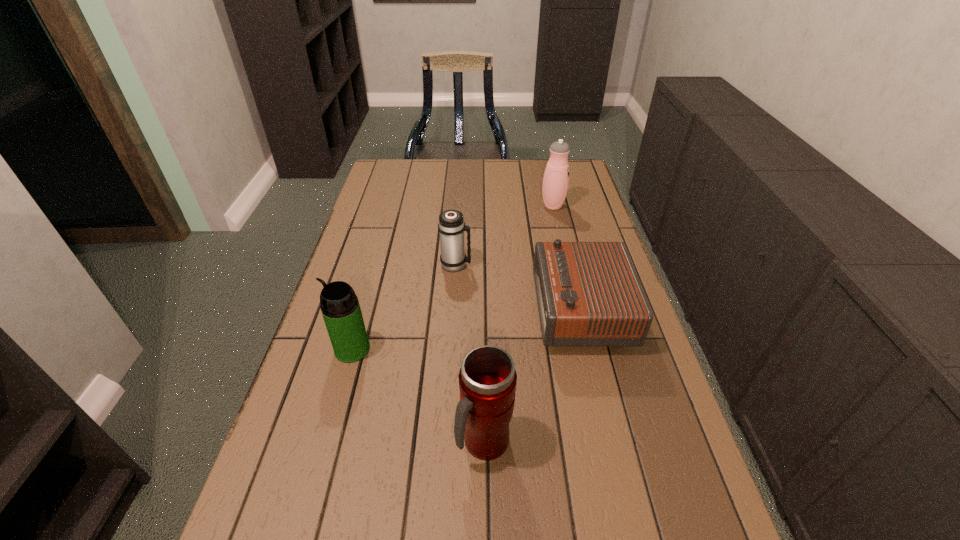
Locate an element on the screen. The height and width of the screenshot is (540, 960). vacant space at the right edge of the desktop is located at coordinates (568, 197).

Where is `free spot between the nearest object and the leftmost object`? Image resolution: width=960 pixels, height=540 pixels. free spot between the nearest object and the leftmost object is located at coordinates (419, 396).

Locate an element on the screen. free space between the second nearest thermos bottle and the shortest thermos bottle is located at coordinates (404, 307).

Where is `free space between the radio receiver and the nearest thermos bottle`? Image resolution: width=960 pixels, height=540 pixels. free space between the radio receiver and the nearest thermos bottle is located at coordinates (533, 376).

Locate an element on the screen. This screenshot has width=960, height=540. unoccupied area between the nearest object and the third farthest thermos bottle is located at coordinates (419, 396).

Identify the location of vacant space that's between the second farthest object and the farthest thermos bottle. 504,235.

I want to click on vacant space that's between the radio receiver and the third nearest thermos bottle, so (x=518, y=288).

Where is `free space between the radio receiver and the nearest thermos bottle`? This screenshot has width=960, height=540. free space between the radio receiver and the nearest thermos bottle is located at coordinates (533, 376).

Image resolution: width=960 pixels, height=540 pixels. Identify the location of free area in between the leftmost thermos bottle and the shortest thermos bottle. (404, 307).

Where is `the third closest object to the farthest thermos bottle`? The height and width of the screenshot is (540, 960). the third closest object to the farthest thermos bottle is located at coordinates (341, 311).